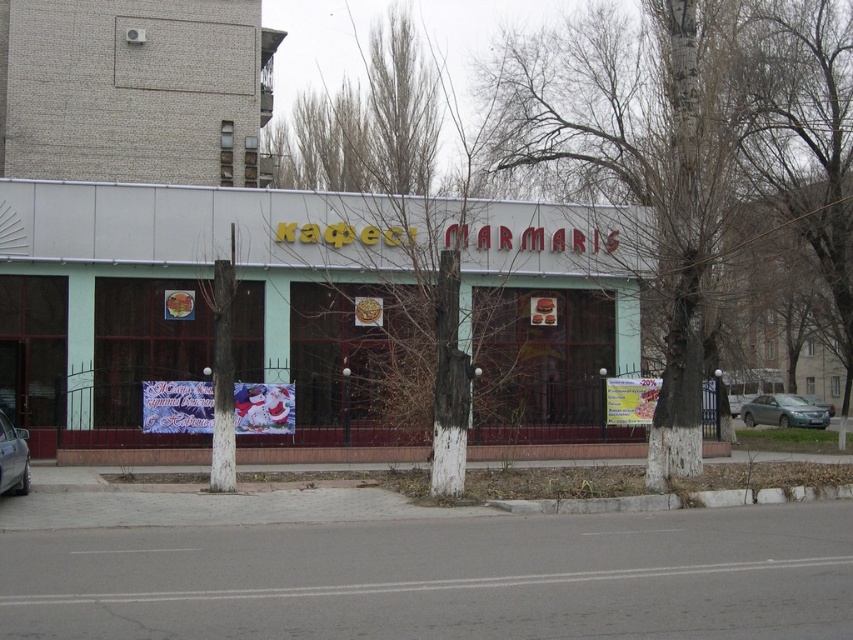
Question: Is green matte building at center wider than silver metallic sedan at center?

Choices:
 (A) yes
 (B) no

Answer: (A)

Question: Which point is closer to the camera taking this photo?

Choices:
 (A) (804, 396)
 (B) (595, 365)
 (C) (790, 406)
 (D) (0, 460)

Answer: (D)

Question: Considering the real-world distances, which object is closest to the silver metallic car at lower left?

Choices:
 (A) green matte building at center
 (B) silver metallic sedan at center

Answer: (A)

Question: Does green matte building at center lie in front of satin silver sedan at right?

Choices:
 (A) yes
 (B) no

Answer: (A)

Question: Among these points, which one is nearest to the camera?

Choices:
 (A) (25, 442)
 (B) (822, 403)

Answer: (A)

Question: Is green matte building at center to the left of silver metallic sedan at center from the viewer's perspective?

Choices:
 (A) no
 (B) yes

Answer: (B)